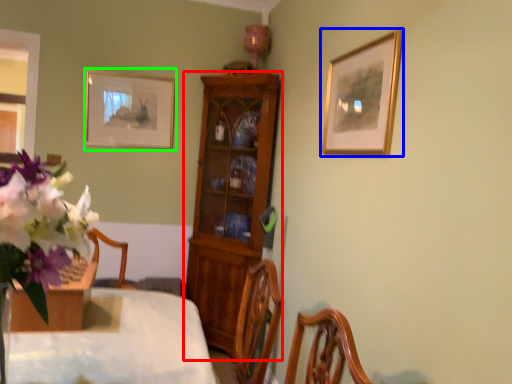
Question: Considering the real-world distances, which object is farthest from cabinetry (highlighted by a red box)? picture frame (highlighted by a blue box) or picture frame (highlighted by a green box)?

Choices:
 (A) picture frame
 (B) picture frame

Answer: (A)